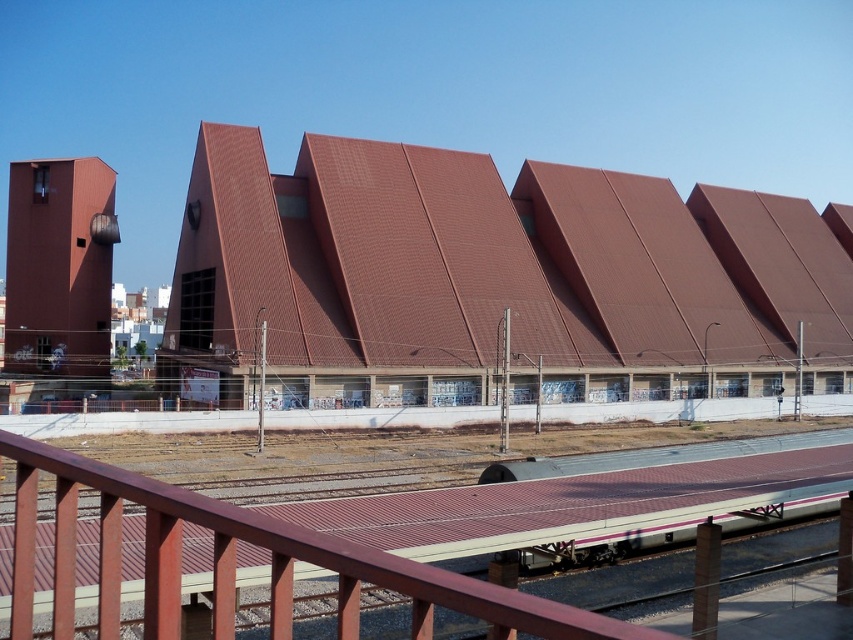
Between brown corrugated metal roof at center and metallic silver train at center, which one has more height?

Standing taller between the two is brown corrugated metal roof at center.

The width and height of the screenshot is (853, 640). Find the location of `brown corrugated metal roof at center`. brown corrugated metal roof at center is located at coordinates (491, 262).